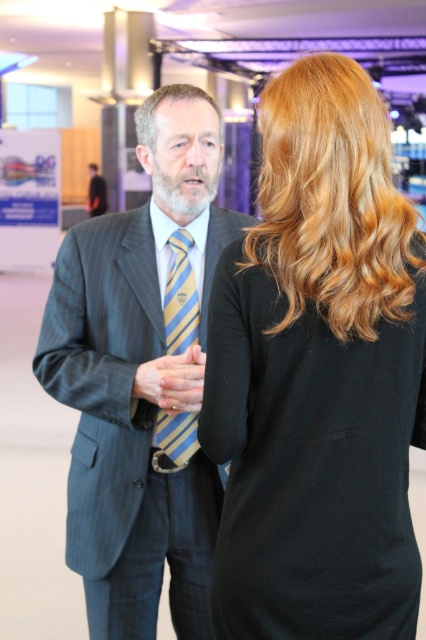
Question: Is smooth black dress at center above matte black suit at center?

Choices:
 (A) yes
 (B) no

Answer: (B)

Question: Estimate the real-world distances between objects in this image. Which object is farther from the matte black suit at center?

Choices:
 (A) yellow striped tie at center
 (B) pinstriped suit at center
 (C) smooth black dress at center

Answer: (C)

Question: Can you confirm if smooth black dress at center is bigger than pinstriped suit at center?

Choices:
 (A) no
 (B) yes

Answer: (A)

Question: Among these objects, which one is farthest from the camera?

Choices:
 (A) pinstriped suit at center
 (B) matte black suit at center

Answer: (B)

Question: Is pinstriped suit at center bigger than yellow striped tie at center?

Choices:
 (A) yes
 (B) no

Answer: (A)

Question: Based on their relative distances, which object is nearer to the pinstriped suit at center?

Choices:
 (A) yellow striped tie at center
 (B) smooth black dress at center

Answer: (A)